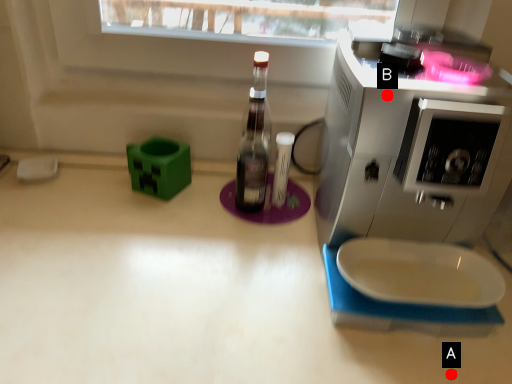
Question: Two points are circled on the image, labeled by A and B beside each circle. Among these points, which one is nearest to the camera?

Choices:
 (A) A is closer
 (B) B is closer

Answer: (B)